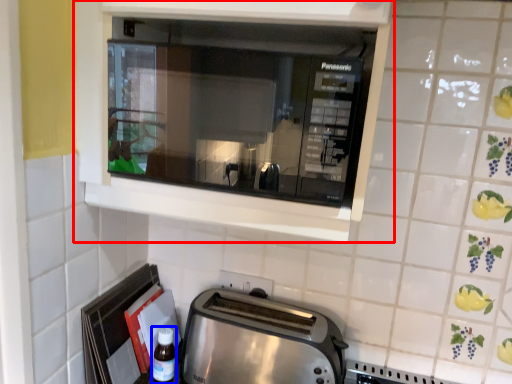
Question: Which of the following is the farthest to the observer, cabinetry (highlighted by a red box) or bottle (highlighted by a blue box)?

Choices:
 (A) cabinetry
 (B) bottle

Answer: (B)